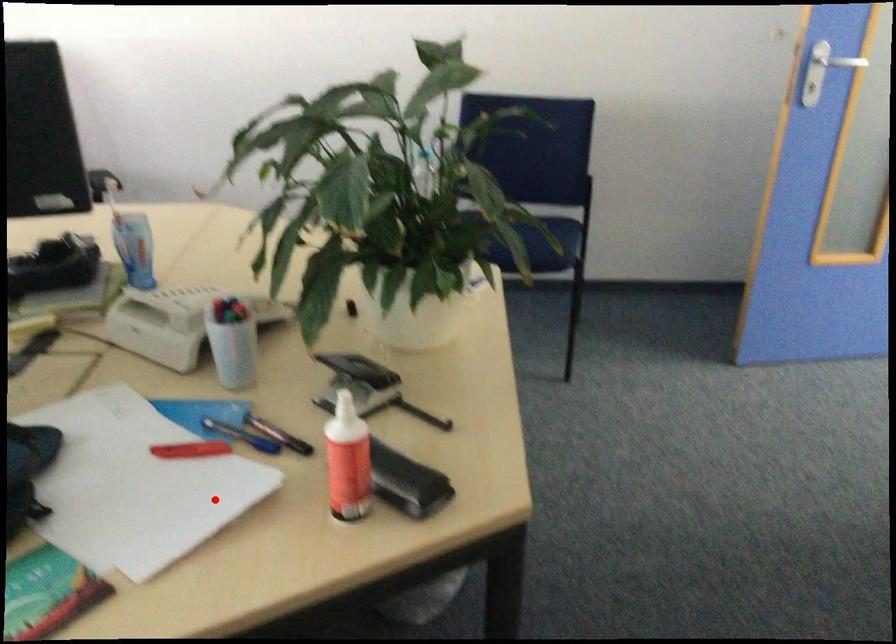
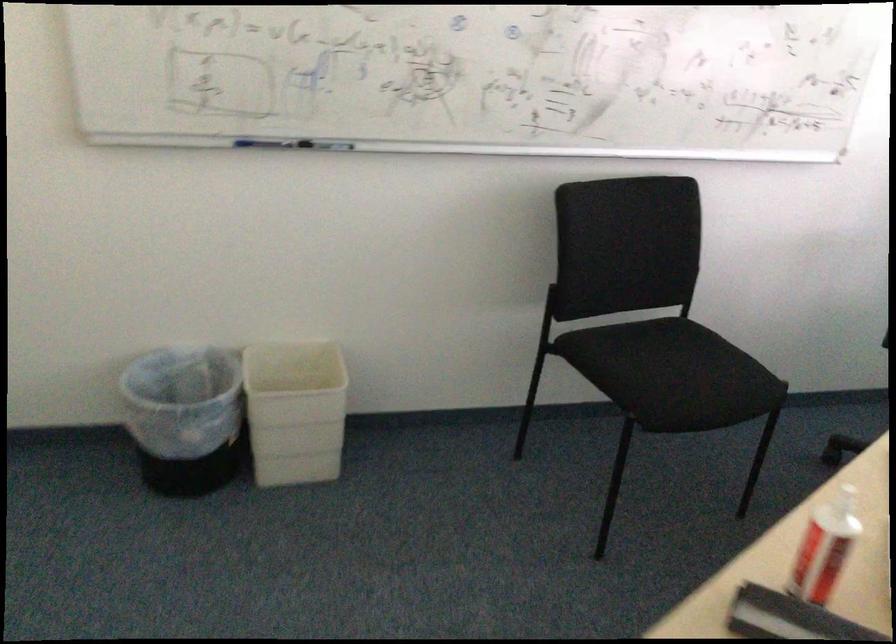
In the second image, find the point that corresponds to the highlighted location in the first image.

(824, 547)